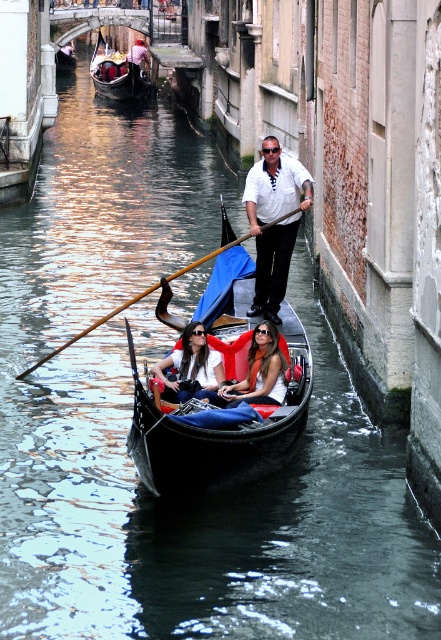
Who is shorter, black polished gondola at center or matte black sunglasses at center?

matte black sunglasses at center

At what (x,y) coordinates should I click in order to perform the action: click on black polished gondola at center. Please return your answer as a coordinate pair (x, y). Image resolution: width=441 pixels, height=640 pixels. Looking at the image, I should click on pos(217,429).

Identify the location of black polished gondola at center. (217, 429).

Image resolution: width=441 pixels, height=640 pixels. I want to click on black polished gondola at center, so click(x=217, y=429).

Who is more forward, (243,400) or (92,65)?

Point (243,400) is in front.

Between point (261, 376) and point (145, 97), which one is positioned behind?

Point (145, 97)

Find the location of a particular element. Image resolution: width=441 pixels, height=640 pixels. matte black gondola at center is located at coordinates (254, 371).

Between black polished gondola at center and white striped shirt at center, which one appears on the right side from the viewer's perspective?

From the viewer's perspective, white striped shirt at center appears more on the right side.

Is black polished gondola at center smaller than white striped shirt at center?

Actually, black polished gondola at center might be larger than white striped shirt at center.

The height and width of the screenshot is (640, 441). Find the location of `black polished gondola at center`. black polished gondola at center is located at coordinates (x=217, y=429).

The height and width of the screenshot is (640, 441). In order to click on black polished gondola at center in this screenshot , I will do `click(217, 429)`.